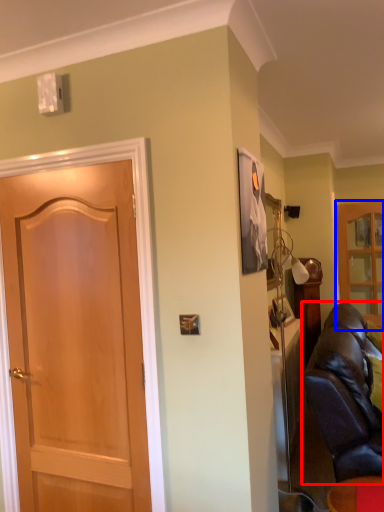
Question: Which object is closer to the camera taking this photo, studio couch (highlighted by a red box) or cabinetry (highlighted by a blue box)?

Choices:
 (A) studio couch
 (B) cabinetry

Answer: (A)